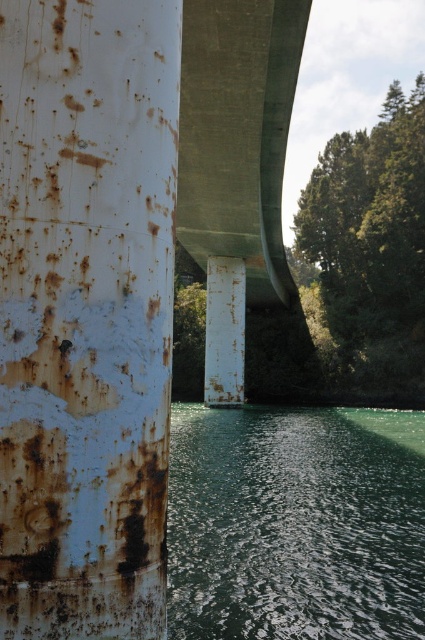
Does green reflective water at lower center have a greater height compared to rusty metal pole at center?

No.

In the scene shown: Does green reflective water at lower center appear on the right side of rusty metal pole at center?

Correct, you'll find green reflective water at lower center to the right of rusty metal pole at center.

Is point (331, 580) farther from camera compared to point (231, 324)?

No, (331, 580) is in front of (231, 324).

Where is `green reflective water at lower center`? The height and width of the screenshot is (640, 425). green reflective water at lower center is located at coordinates (295, 524).

Who is more forward, (161,560) or (243,330)?

Point (161,560) is in front.

Between rusty metal pole at left and rusty metal pole at center, which one is positioned lower?

Positioned lower is rusty metal pole at center.

Which is behind, point (42, 385) or point (214, 268)?

Positioned behind is point (214, 268).

The image size is (425, 640). In order to click on rusty metal pole at left in this screenshot , I will do `click(85, 314)`.

Based on the photo, is rusty metal pole at left smaller than green reflective water at lower center?

Yes, rusty metal pole at left is smaller than green reflective water at lower center.

What do you see at coordinates (85, 314) in the screenshot? I see `rusty metal pole at left` at bounding box center [85, 314].

Where is `rusty metal pole at left`? The width and height of the screenshot is (425, 640). rusty metal pole at left is located at coordinates (x=85, y=314).